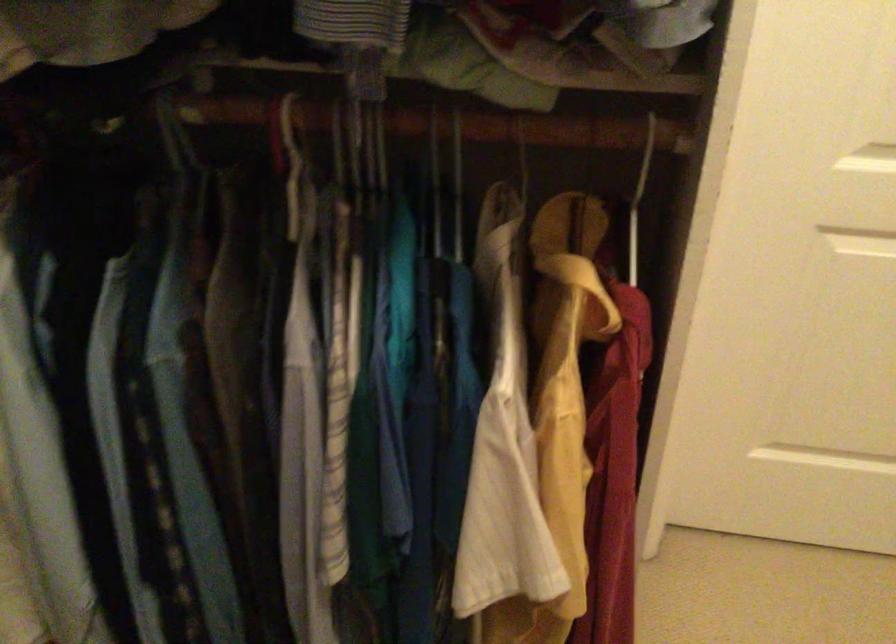
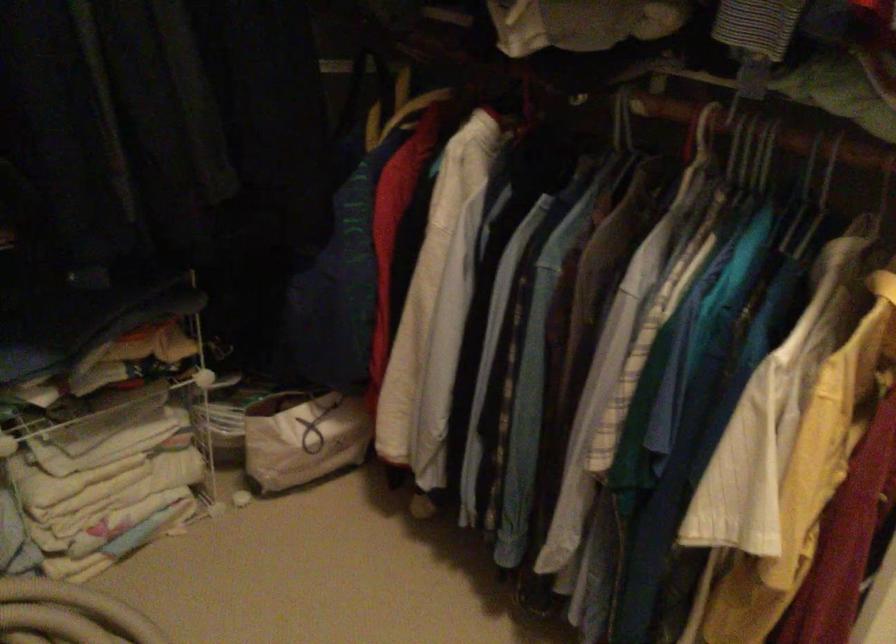
Find the pixel in the second image that matches the point at 293,134 in the first image.

(702, 134)